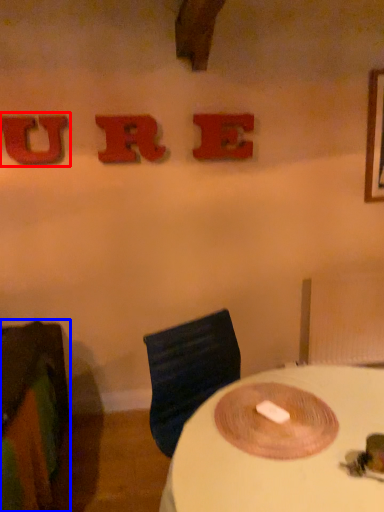
Question: Which point is closer to the camera, alphabet (highlighted by a red box) or furniture (highlighted by a blue box)?

Choices:
 (A) alphabet
 (B) furniture

Answer: (B)